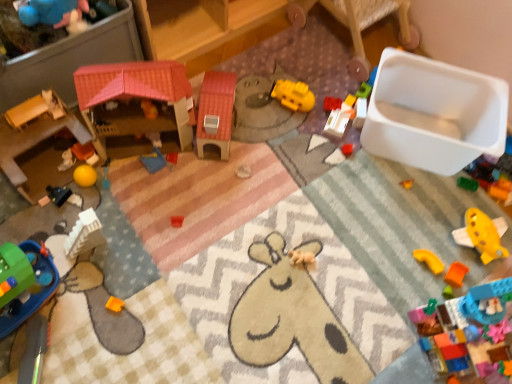
This screenshot has width=512, height=384. I want to click on vacant area that lies between matte orange blocks at left, positioned as the fifth toy in left-to-right order, and blue plastic tray at center, which ranks as the 10th toy in right-to-left order, so click(119, 164).